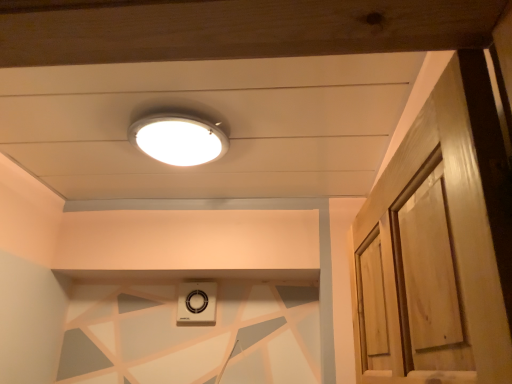
Question: Is white glossy lamp at upper center smaller than white plastic vent at lower center?

Choices:
 (A) no
 (B) yes

Answer: (A)

Question: Would you say white glossy lamp at upper center contains white plastic vent at lower center?

Choices:
 (A) no
 (B) yes

Answer: (A)

Question: Considering the relative positions of white glossy lamp at upper center and white plastic vent at lower center in the image provided, is white glossy lamp at upper center behind white plastic vent at lower center?

Choices:
 (A) yes
 (B) no

Answer: (B)

Question: Can you confirm if white glossy lamp at upper center is bigger than white plastic vent at lower center?

Choices:
 (A) yes
 (B) no

Answer: (A)

Question: Is white glossy lamp at upper center at the left side of white plastic vent at lower center?

Choices:
 (A) yes
 (B) no

Answer: (B)

Question: Can you confirm if white glossy lamp at upper center is wider than white plastic vent at lower center?

Choices:
 (A) yes
 (B) no

Answer: (A)

Question: Is white plastic vent at lower center placed right next to white glossy lamp at upper center?

Choices:
 (A) yes
 (B) no

Answer: (B)

Question: From a real-world perspective, is white plastic vent at lower center over white glossy lamp at upper center?

Choices:
 (A) no
 (B) yes

Answer: (A)

Question: Is white plastic vent at lower center wider than white glossy lamp at upper center?

Choices:
 (A) no
 (B) yes

Answer: (A)

Question: From a real-world perspective, is white plastic vent at lower center below white glossy lamp at upper center?

Choices:
 (A) no
 (B) yes

Answer: (B)

Question: Could white glossy lamp at upper center be considered to be inside white plastic vent at lower center?

Choices:
 (A) no
 (B) yes

Answer: (A)

Question: Are white plastic vent at lower center and white glossy lamp at upper center far apart?

Choices:
 (A) yes
 (B) no

Answer: (B)

Question: Based on their positions, is white plastic vent at lower center located to the left or right of white glossy lamp at upper center?

Choices:
 (A) right
 (B) left

Answer: (B)